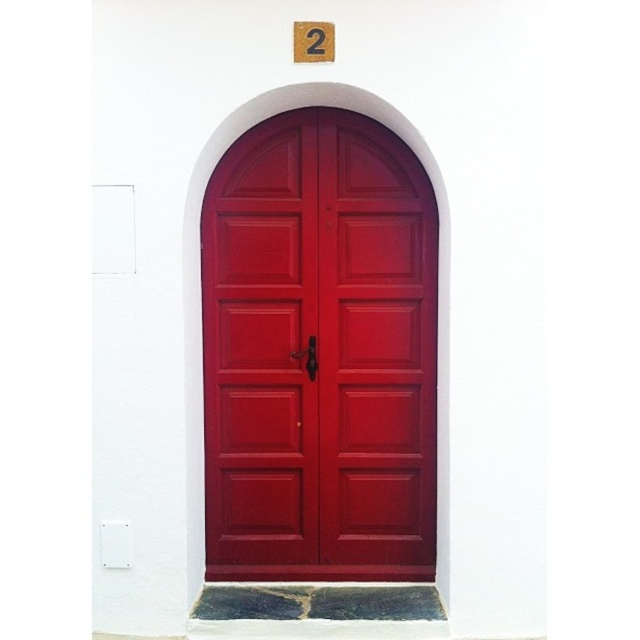
Question: Which point is closer to the camera taking this photo?

Choices:
 (A) (237, 157)
 (B) (332, 32)

Answer: (B)

Question: Is matte wood door at center positioned behind wooden number at upper center?

Choices:
 (A) yes
 (B) no

Answer: (A)

Question: Which of the following is the closest to the observer?

Choices:
 (A) click(x=401, y=161)
 (B) click(x=308, y=45)

Answer: (B)

Question: Can you confirm if matte wood door at center is positioned to the right of wooden number at upper center?

Choices:
 (A) yes
 (B) no

Answer: (A)

Question: Is matte wood door at center bigger than wooden number at upper center?

Choices:
 (A) no
 (B) yes

Answer: (B)